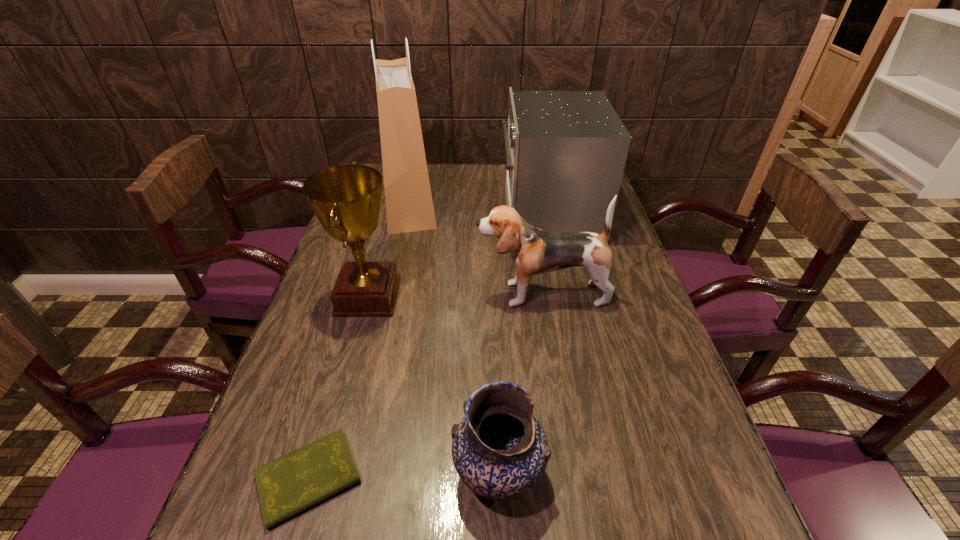
Find the location of a particular element. The width and height of the screenshot is (960, 540). shopping bag is located at coordinates (409, 207).

In order to click on toaster oven in this screenshot , I will do `click(565, 151)`.

This screenshot has width=960, height=540. I want to click on award, so click(346, 199).

The height and width of the screenshot is (540, 960). What are the coordinates of `puppy` in the screenshot? It's located at (x=533, y=251).

What are the coordinates of `the second shortest object` in the screenshot? It's located at (500, 451).

The image size is (960, 540). I want to click on diary, so click(x=288, y=485).

Where is `free location located on the right of the tallest object`? The width and height of the screenshot is (960, 540). free location located on the right of the tallest object is located at coordinates (529, 202).

Image resolution: width=960 pixels, height=540 pixels. Identify the location of vacant space located 0.360m on the front panel of the toaster oven. (391, 215).

Locate an element on the screen. The width and height of the screenshot is (960, 540). free location located 0.140m on the front panel of the toaster oven is located at coordinates (458, 215).

Find the location of a particular element. The width and height of the screenshot is (960, 540). vacant space positioned 0.330m on the front panel of the toaster oven is located at coordinates (399, 215).